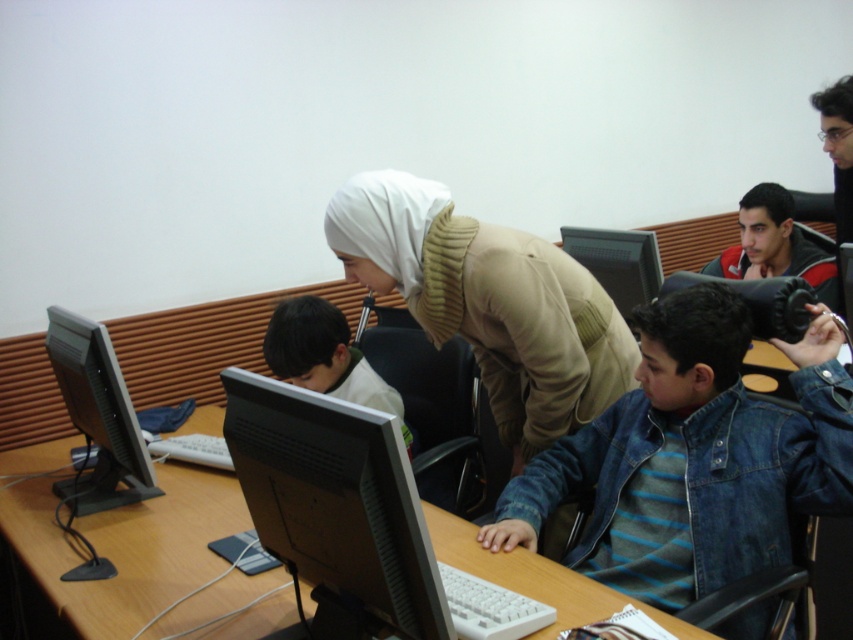
Based on the photo, you are standing at the entrance of the classroom and see the beige knit sweater at center. Can you estimate how far it is from the entrance based on its coordinates?

The beige knit sweater at center is located at point (489,304), which means it is approximately 0.574 meters away from the entrance along the vertical axis and 0.475 meters along the horizontal axis. However, without knowing the exact dimensions of the room, it is difficult to provide an accurate distance in real measurements.